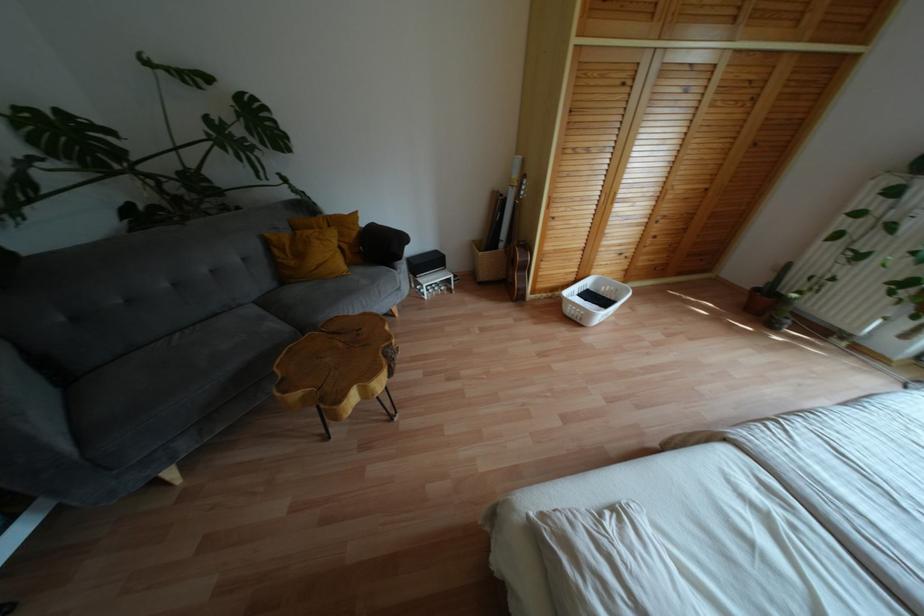
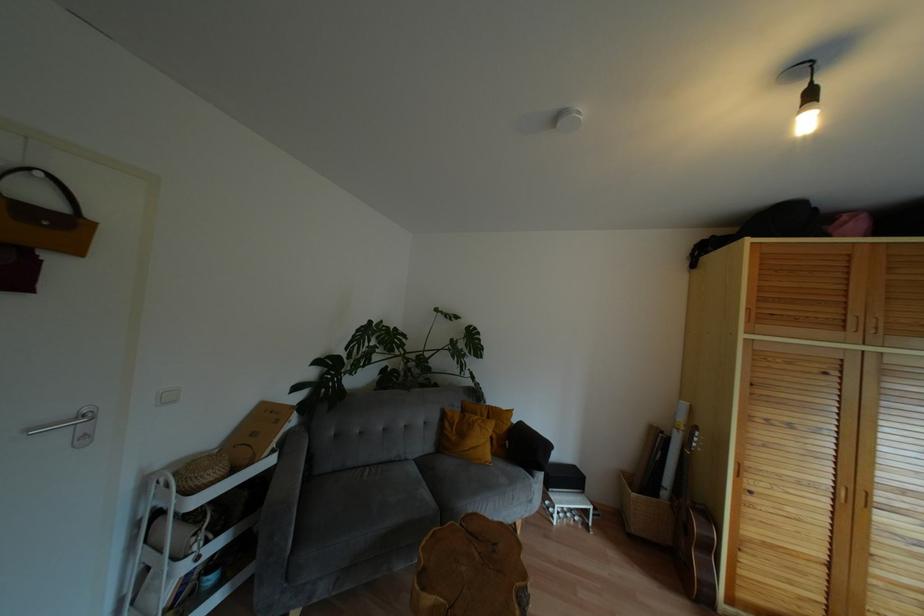
Find the pixel in the second image that matches (354,214) in the first image.

(508, 411)